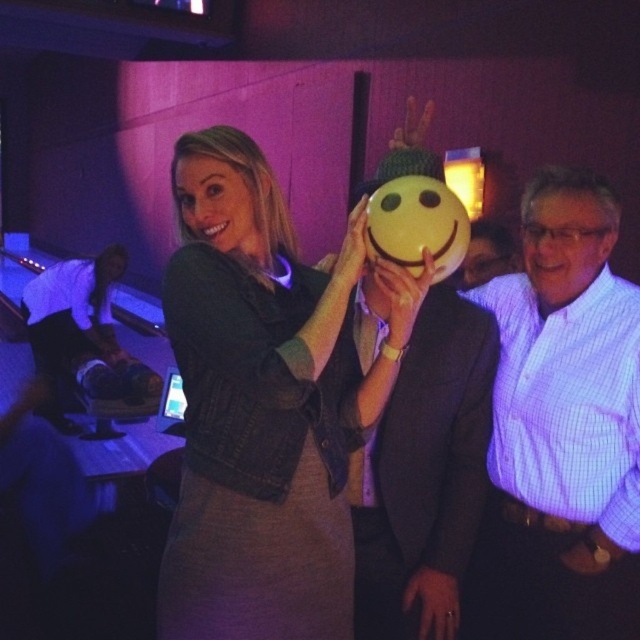
Measure the distance between matte purple shirt at right and camera.

A distance of 4.93 feet exists between matte purple shirt at right and camera.

The height and width of the screenshot is (640, 640). Find the location of `matte purple shirt at right`. matte purple shirt at right is located at coordinates (564, 243).

This screenshot has height=640, width=640. In order to click on matte purple shirt at right in this screenshot , I will do `click(564, 243)`.

I want to click on matte purple shirt at right, so click(x=564, y=243).

Does point (557, 218) lie behind point (509, 266)?

No, it is in front of (509, 266).

Between point (586, 225) and point (477, 268), which one is positioned behind?

The point (477, 268) is behind.

Locate an element on the screen. The image size is (640, 640). matte purple shirt at right is located at coordinates (564, 243).

Who is positioned more to the right, matte black dress at center or smooth skin face at center?

matte black dress at center is more to the right.

This screenshot has width=640, height=640. Describe the element at coordinates (268, 401) in the screenshot. I see `matte black dress at center` at that location.

Which is in front, point (332, 534) or point (196, 170)?

Positioned in front is point (196, 170).

Locate an element on the screen. This screenshot has height=640, width=640. matte black dress at center is located at coordinates (268, 401).